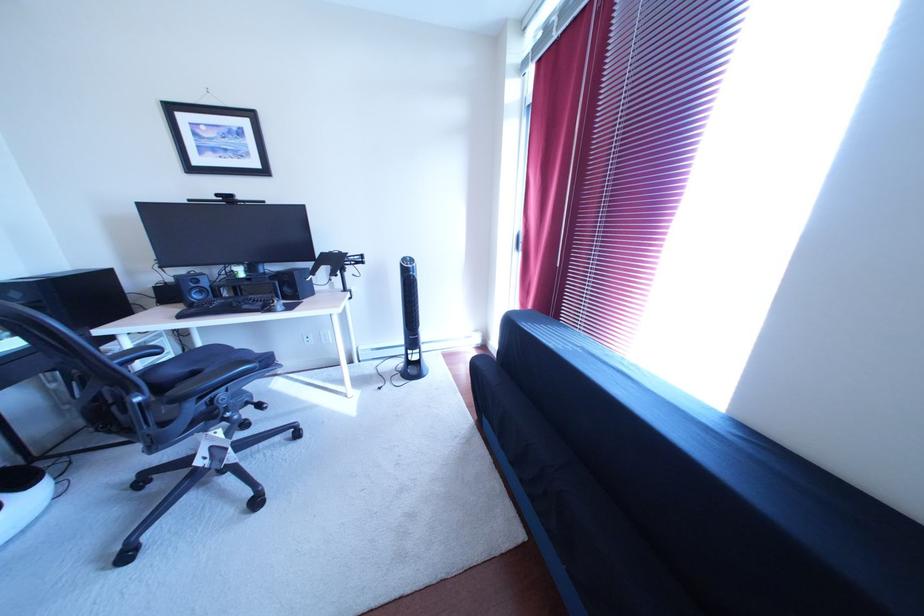
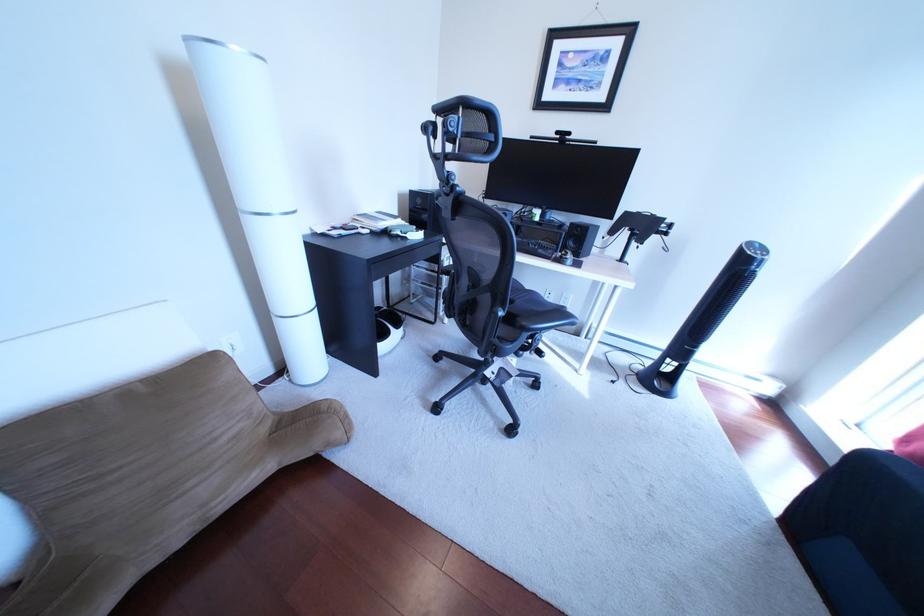
Question: The camera is either moving clockwise (left) or counter-clockwise (right) around the object. The first image is from the beginning of the video and the second image is from the end. Is the camera moving left or right when shooting the video?

Choices:
 (A) Left
 (B) Right

Answer: (B)